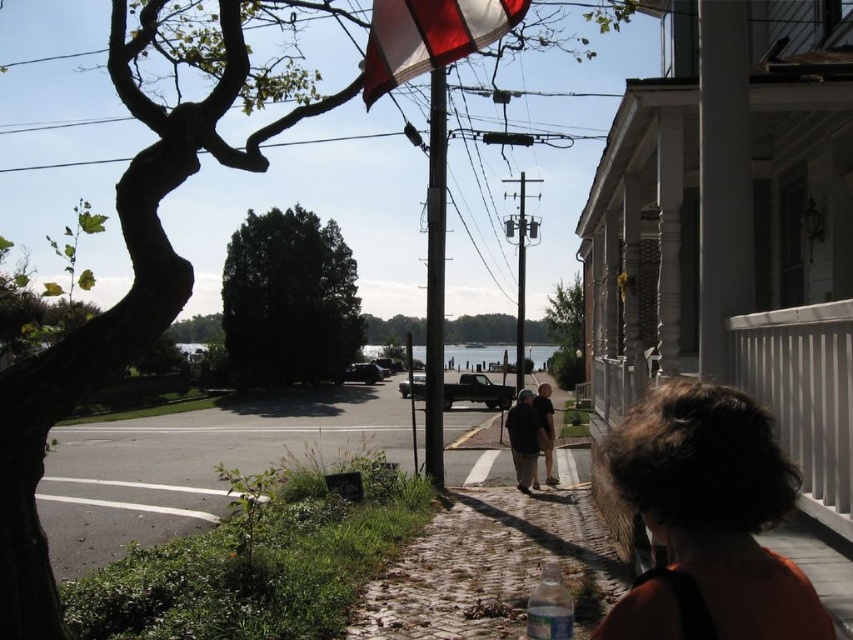
Is red fabric flag at upper center wider than dark brown leather shoes at center?

Indeed, red fabric flag at upper center has a greater width compared to dark brown leather shoes at center.

Which of these two, red fabric flag at upper center or dark brown leather shoes at center, stands shorter?

dark brown leather shoes at center is shorter.

This screenshot has height=640, width=853. I want to click on red fabric flag at upper center, so (428, 36).

Does point (712, 488) lie in front of point (473, 45)?

Yes.

Is dark brown hair at lower right below red fabric flag at upper center?

Yes, dark brown hair at lower right is below red fabric flag at upper center.

Measure the distance between point (758, 429) and camera.

4.40 feet

Identify the location of dark brown hair at lower right. (717, 504).

In the scene shown: Does dark brown hair at lower right have a lesser height compared to dark brown leather shoes at center?

No, dark brown hair at lower right is not shorter than dark brown leather shoes at center.

Does dark brown hair at lower right appear on the left side of dark brown leather shoes at center?

Yes, dark brown hair at lower right is to the left of dark brown leather shoes at center.

Who is more distant from viewer, (735, 432) or (523, 419)?

Positioned behind is point (523, 419).

Locate an element on the screen. The image size is (853, 640). dark brown hair at lower right is located at coordinates (717, 504).